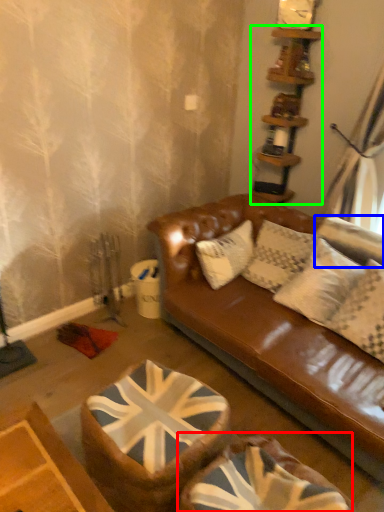
Question: Estimate the real-world distances between objects in this image. Which object is farther from swivel chair (highlighted by a red box), pillow (highlighted by a blue box) or shelf (highlighted by a green box)?

Choices:
 (A) pillow
 (B) shelf

Answer: (B)